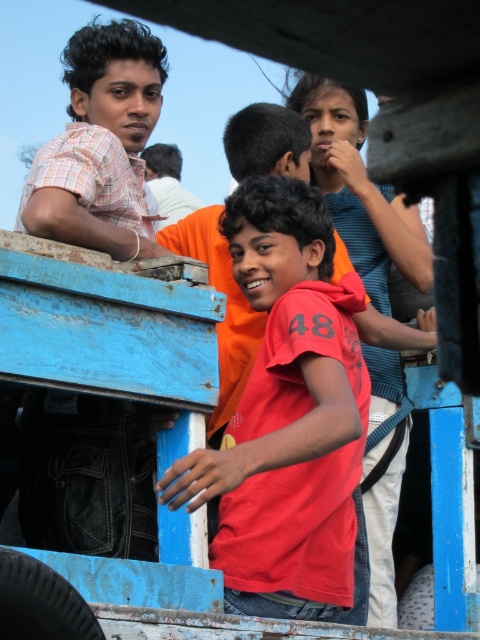
Question: Does matte plaid shirt at left have a lesser width compared to white shirt at center?

Choices:
 (A) yes
 (B) no

Answer: (B)

Question: Considering the relative positions of matte red t-shirt at center and white shirt at center in the image provided, where is matte red t-shirt at center located with respect to white shirt at center?

Choices:
 (A) right
 (B) left

Answer: (A)

Question: Which object is positioned farthest from the white shirt at center?

Choices:
 (A) matte red t-shirt at center
 (B) matte plaid shirt at left

Answer: (A)

Question: Does matte red t-shirt at center appear on the left side of matte plaid shirt at left?

Choices:
 (A) yes
 (B) no

Answer: (B)

Question: Which is nearer to the white shirt at center?

Choices:
 (A) matte red t-shirt at center
 (B) matte plaid shirt at left

Answer: (B)

Question: Which point is closer to the camera?

Choices:
 (A) (35, 396)
 (B) (335, 412)
 (C) (180, 161)

Answer: (B)